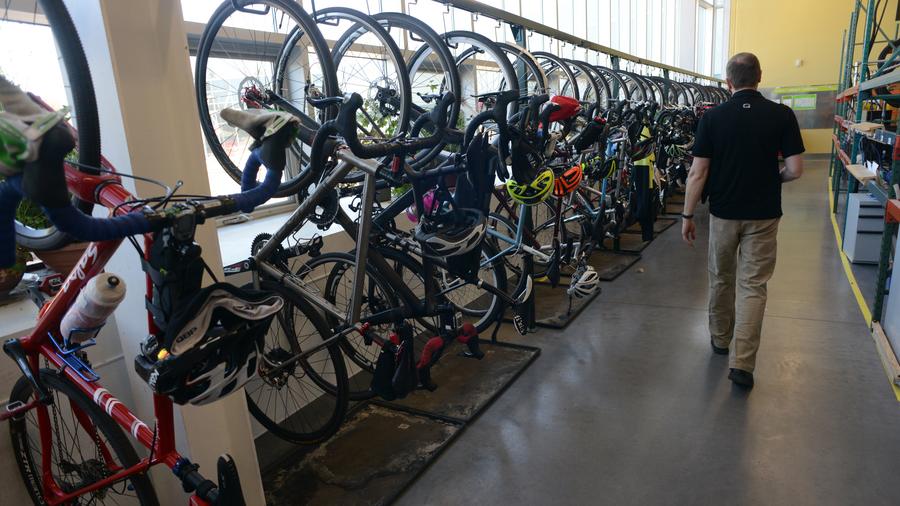
What are the coordinates of `column` in the screenshot? It's located at (158, 93).